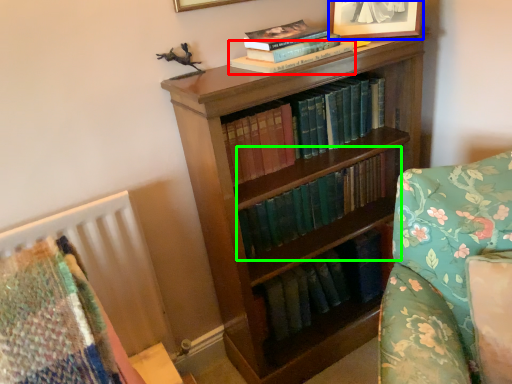
Question: Estimate the real-world distances between objects in this image. Which object is farther from book (highlighted by a red box), picture frame (highlighted by a blue box) or book (highlighted by a green box)?

Choices:
 (A) picture frame
 (B) book

Answer: (B)